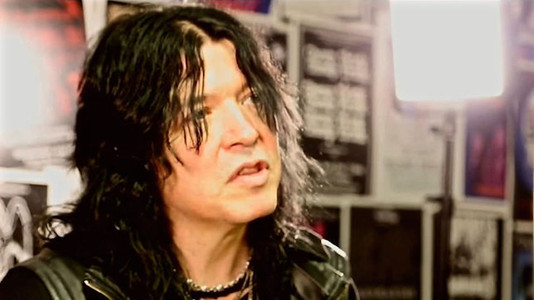
You are a GUI agent. You are given a task and a screenshot of the screen. Output one action in this format:
    pyautogui.click(x=<x>, y=<y>)
    Task: Click on the wall
    The height and width of the screenshot is (300, 534).
    Given the screenshot: What is the action you would take?
    pyautogui.click(x=362, y=137)